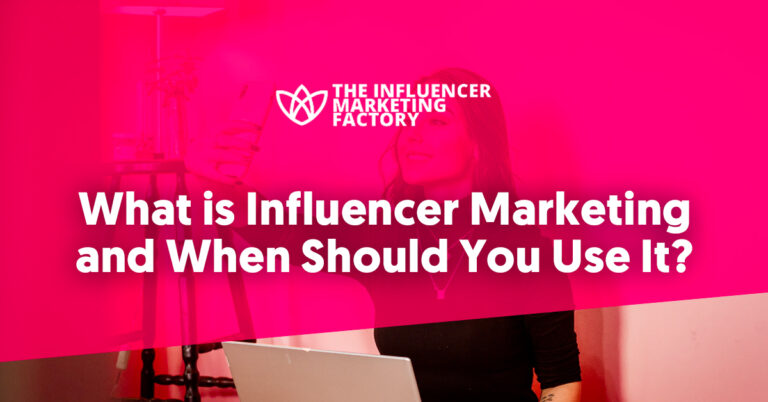
At what (x,y) coordinates should I click in order to perform the action: click on stool legs. Please return your answer as a coordinate pair (x, y). Looking at the image, I should click on (186, 398), (137, 390).